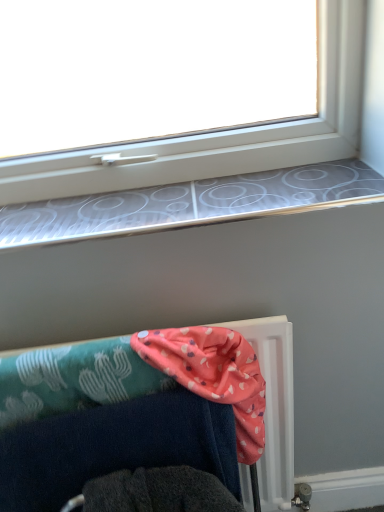
Question: Could you tell me if pink fabric at lower center is turned towards silver metallic window sill at upper center?

Choices:
 (A) no
 (B) yes

Answer: (A)

Question: Considering the relative sizes of pink fabric at lower center and silver metallic window sill at upper center in the image provided, is pink fabric at lower center shorter than silver metallic window sill at upper center?

Choices:
 (A) yes
 (B) no

Answer: (B)

Question: Is pink fabric at lower center in front of silver metallic window sill at upper center?

Choices:
 (A) no
 (B) yes

Answer: (B)

Question: From a real-world perspective, is pink fabric at lower center positioned under silver metallic window sill at upper center based on gravity?

Choices:
 (A) no
 (B) yes

Answer: (B)

Question: Is silver metallic window sill at upper center inside pink fabric at lower center?

Choices:
 (A) no
 (B) yes

Answer: (A)

Question: In terms of height, does pink fabric at lower right look taller or shorter compared to silver metallic window sill at upper center?

Choices:
 (A) tall
 (B) short

Answer: (A)

Question: Is pink fabric at lower right wider or thinner than silver metallic window sill at upper center?

Choices:
 (A) wide
 (B) thin

Answer: (B)

Question: Considering the positions of point (281, 354) and point (264, 199), is point (281, 354) closer or farther from the camera than point (264, 199)?

Choices:
 (A) closer
 (B) farther

Answer: (B)

Question: Visually, is pink fabric at lower right positioned to the left or to the right of silver metallic window sill at upper center?

Choices:
 (A) right
 (B) left

Answer: (B)

Question: From the image's perspective, is pink fabric at lower center positioned above or below pink fabric at lower right?

Choices:
 (A) above
 (B) below

Answer: (A)

Question: Looking at the image, does pink fabric at lower center seem bigger or smaller compared to pink fabric at lower right?

Choices:
 (A) big
 (B) small

Answer: (B)

Question: Would you say pink fabric at lower center is to the left or to the right of pink fabric at lower right in the picture?

Choices:
 (A) left
 (B) right

Answer: (B)

Question: From a real-world perspective, is pink fabric at lower center above or below pink fabric at lower right?

Choices:
 (A) below
 (B) above

Answer: (B)

Question: In terms of size, does pink fabric at lower right appear bigger or smaller than pink fabric at lower center?

Choices:
 (A) big
 (B) small

Answer: (A)

Question: Considering the positions of point (274, 413) and point (218, 368), is point (274, 413) closer or farther from the camera than point (218, 368)?

Choices:
 (A) farther
 (B) closer

Answer: (A)